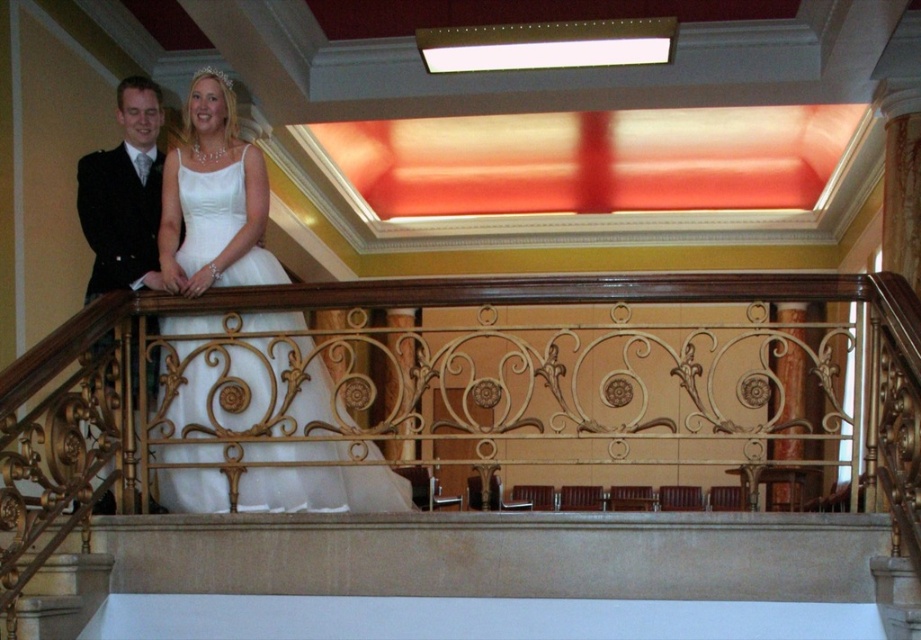
Is point (376, 476) positioned in front of point (142, 227)?

Yes, point (376, 476) is in front of point (142, 227).

Identify the location of white satin dress at center. (323, 490).